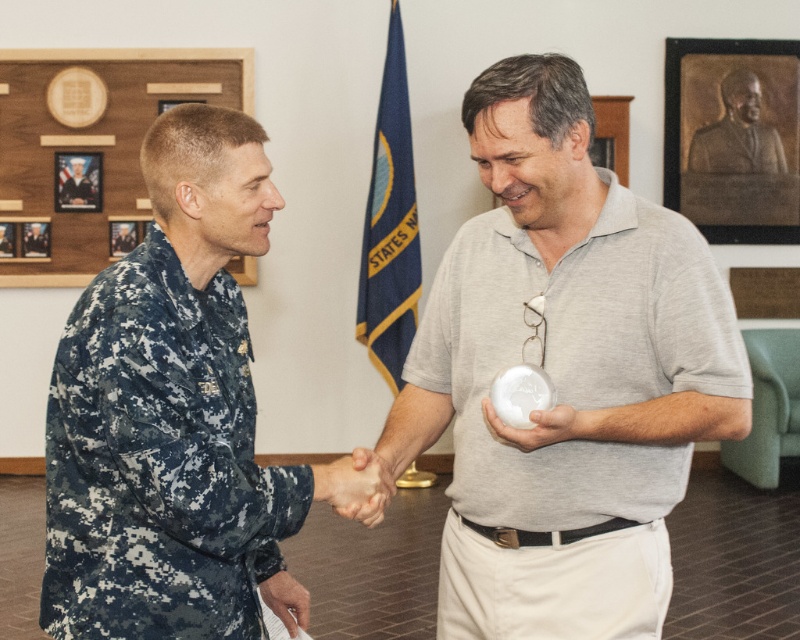
Locate an element on the screen. The height and width of the screenshot is (640, 800). white glossy sphere at center is located at coordinates (564, 376).

Which is behind, point (550, 554) or point (748, 93)?

The point (748, 93) is behind.

Does point (446, 545) come closer to viewer compared to point (762, 140)?

Yes, it is in front of point (762, 140).

The width and height of the screenshot is (800, 640). In order to click on white glossy sphere at center in this screenshot , I will do click(564, 376).

Does point (545, 308) come farther from viewer compared to point (80, 179)?

No, it is not.

Identify the location of white glossy sphere at center. (564, 376).

Is point (740, 388) farther from viewer compared to point (80, 202)?

No, it is in front of (80, 202).

Where is `white glossy sphere at center`? The image size is (800, 640). white glossy sphere at center is located at coordinates (564, 376).

Can you confirm if bronze bust at upper right is positioned above camouflage uniform at center?

Yes, bronze bust at upper right is above camouflage uniform at center.

Consider the image. Which of these two, bronze bust at upper right or camouflage uniform at center, stands taller?

bronze bust at upper right is taller.

You are a GUI agent. You are given a task and a screenshot of the screen. Output one action in this format:
    pyautogui.click(x=<x>, y=<y>)
    Task: Click on the bronze bust at upper right
    The width and height of the screenshot is (800, 640).
    Given the screenshot: What is the action you would take?
    pyautogui.click(x=737, y=132)